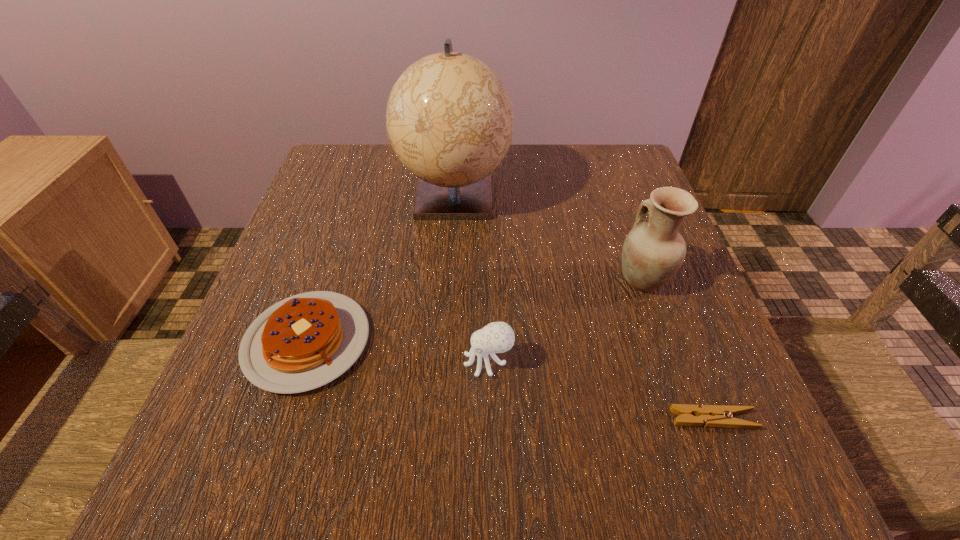
What are the coordinates of `vacant space located on the front-facing side of the third tallest object` in the screenshot? It's located at (234, 361).

Where is `free space located 0.250m on the front-facing side of the third tallest object`? The width and height of the screenshot is (960, 540). free space located 0.250m on the front-facing side of the third tallest object is located at coordinates (309, 361).

Where is `vacant space located on the back of the second shortest object`? Image resolution: width=960 pixels, height=540 pixels. vacant space located on the back of the second shortest object is located at coordinates (346, 226).

Where is `blank space located on the left of the shortest object`? Image resolution: width=960 pixels, height=540 pixels. blank space located on the left of the shortest object is located at coordinates (451, 420).

In order to click on object located in the far edge section of the desktop in this screenshot , I will do `click(450, 120)`.

This screenshot has height=540, width=960. I want to click on object located at the left edge, so click(305, 341).

At what (x,y) coordinates should I click in order to perform the action: click on pottery located at the right edge. Please return your answer as a coordinate pair (x, y). Looking at the image, I should click on (652, 253).

Image resolution: width=960 pixels, height=540 pixels. I want to click on clothespin that is at the right edge, so click(720, 416).

Where is `free space at the far edge of the desktop`? The height and width of the screenshot is (540, 960). free space at the far edge of the desktop is located at coordinates (502, 180).

The height and width of the screenshot is (540, 960). What are the coordinates of `vacant space at the near edge` in the screenshot? It's located at (372, 482).